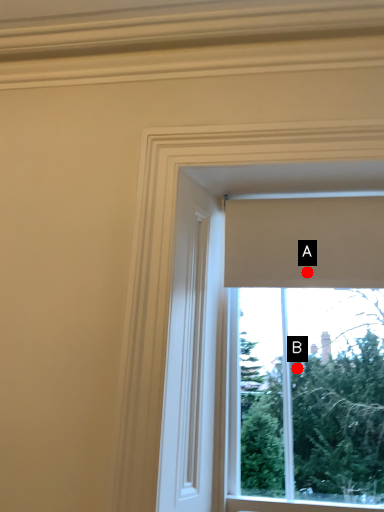
Question: Two points are circled on the image, labeled by A and B beside each circle. Which point is farther to the camera?

Choices:
 (A) A is further
 (B) B is further

Answer: (B)